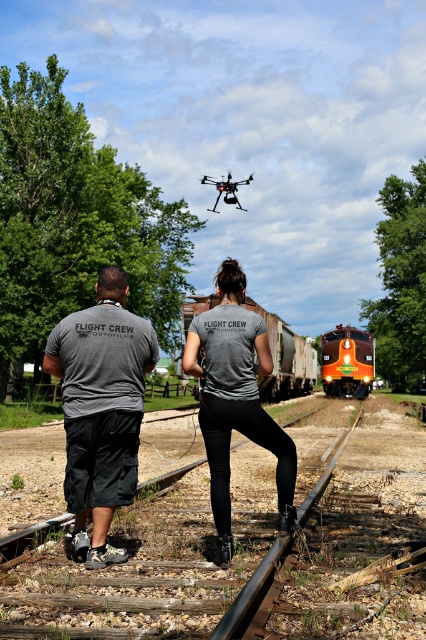
Between maroon glossy train at center and black matte drone at center, which one has less height?

With less height is maroon glossy train at center.

Who is more forward, (x=339, y=352) or (x=230, y=202)?

Point (x=339, y=352) is more forward.

Find the location of a particular element. maroon glossy train at center is located at coordinates (347, 362).

Between gray matte shirt at center and orange freight train at center, which one is positioned lower?

orange freight train at center is lower down.

Can you confirm if gray matte shirt at center is positioned to the right of orange freight train at center?

Incorrect, gray matte shirt at center is not on the right side of orange freight train at center.

Between point (224, 392) and point (258, 385), which one is positioned in front?

Point (224, 392) is more forward.

Identify the location of gray matte shirt at center. This screenshot has width=426, height=640. (236, 397).

Is gray fabric shirt at center behind black matte drone at center?

No, gray fabric shirt at center is closer to the viewer.

Is gray fabric shirt at center bigger than black matte drone at center?

Incorrect, gray fabric shirt at center is not larger than black matte drone at center.

Is point (86, 428) in front of point (224, 198)?

Yes, point (86, 428) is in front of point (224, 198).

In order to click on gray fabric shirt at center in this screenshot , I will do `click(100, 410)`.